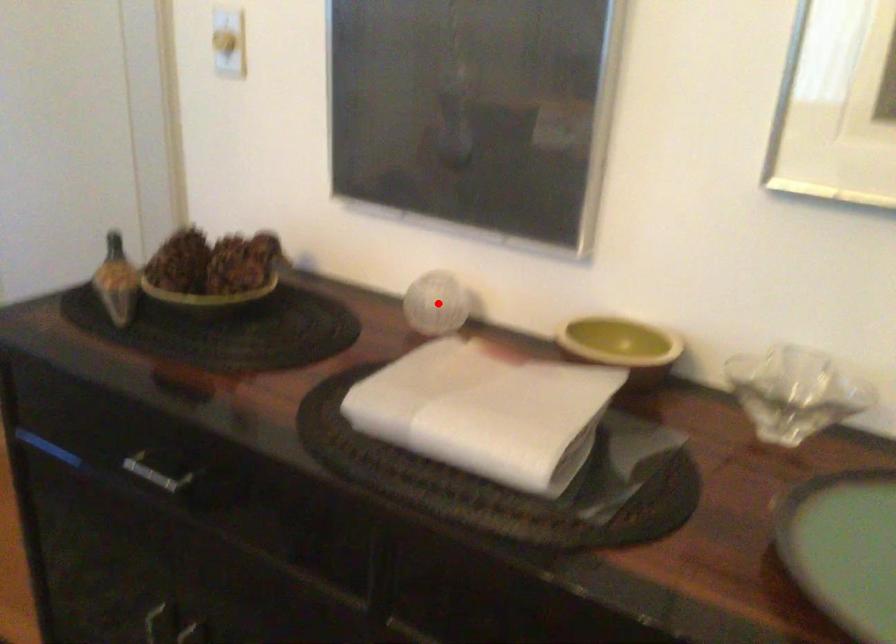
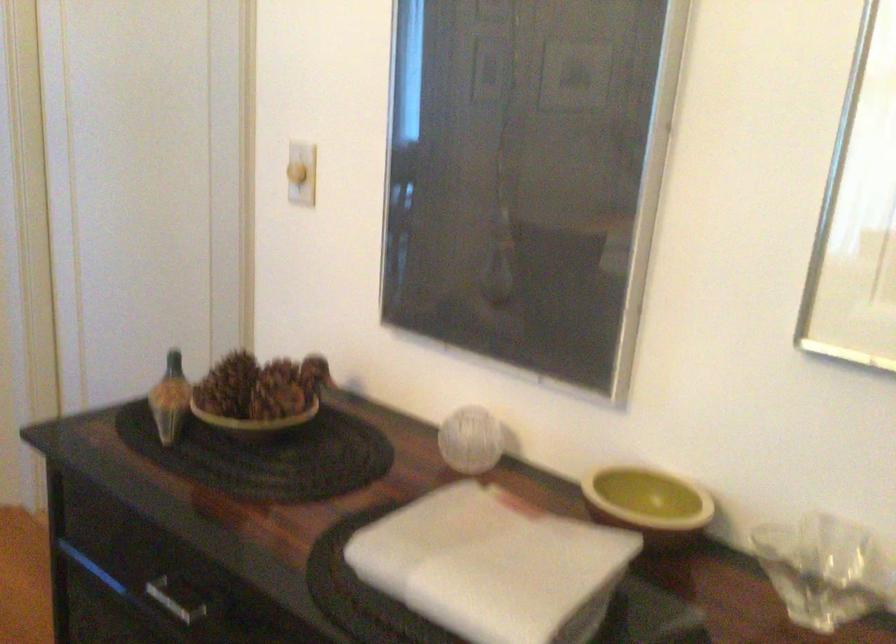
Locate, in the second image, the point that corresponds to the highlighted location in the first image.

(470, 440)